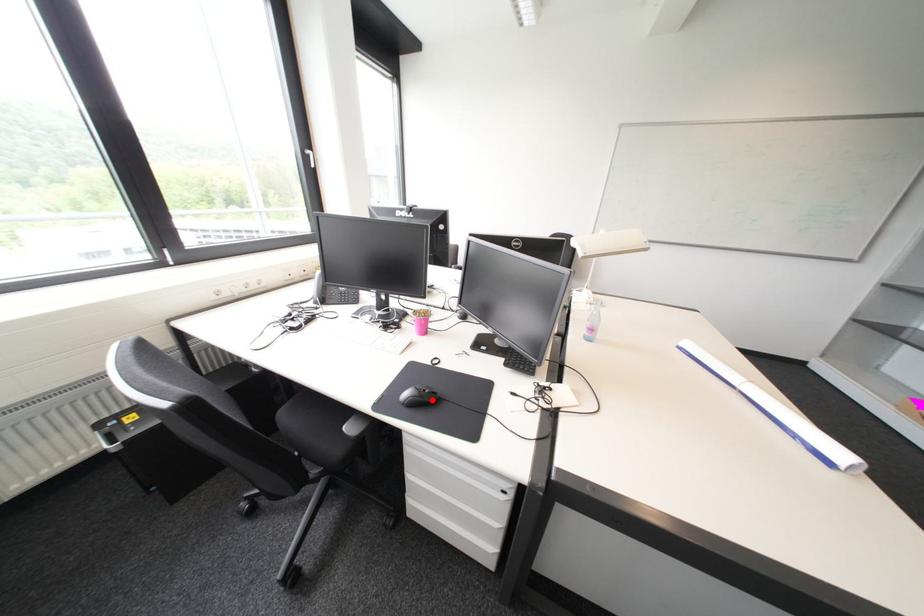
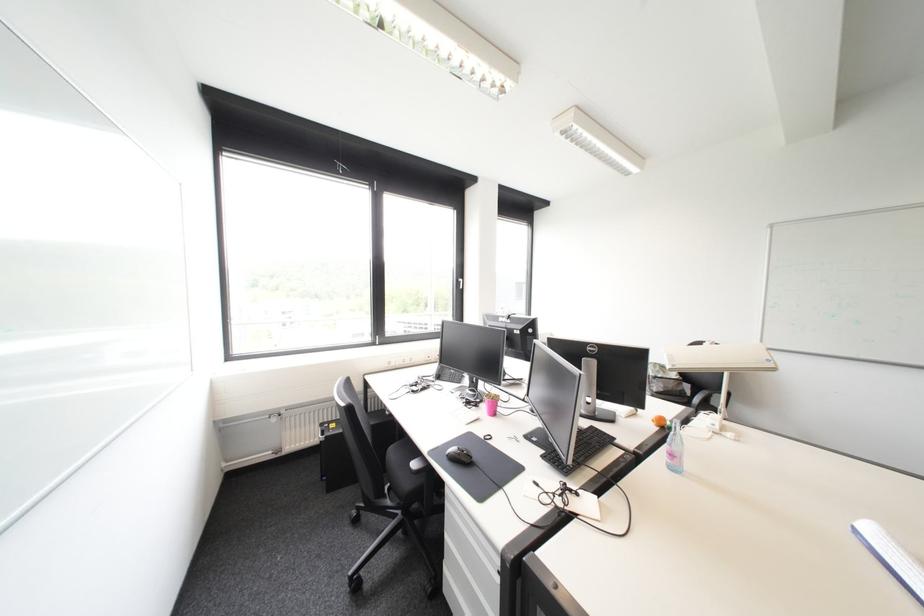
Where in the second image is the point corresponding to the highlighted location from the first image?

(468, 458)